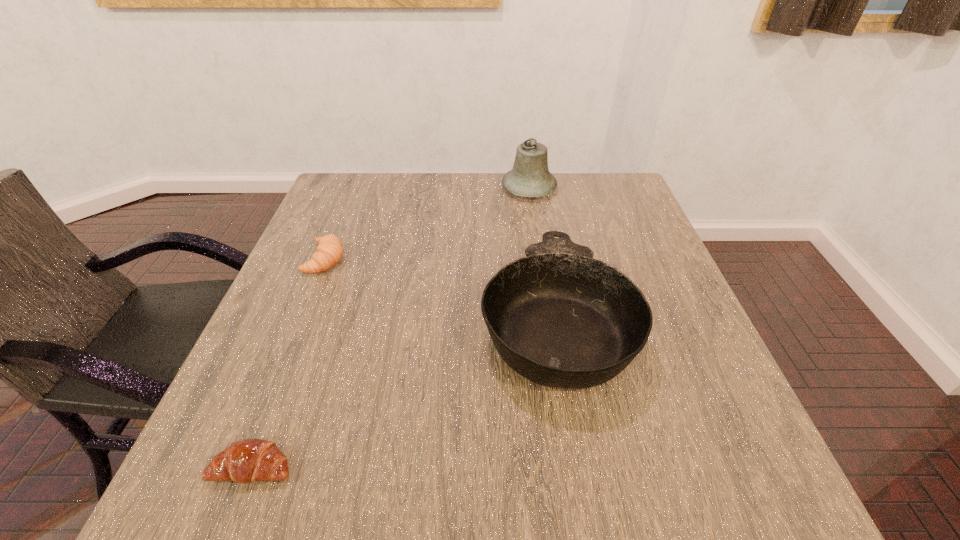
You are a GUI agent. You are given a task and a screenshot of the screen. Output one action in this format:
    pyautogui.click(x=<x>, y=<y>)
    Task: Click on the farthest object
    The width and height of the screenshot is (960, 540).
    Given the screenshot: What is the action you would take?
    pyautogui.click(x=530, y=177)

Where is `bell`? This screenshot has height=540, width=960. bell is located at coordinates (530, 177).

You are a GUI agent. You are given a task and a screenshot of the screen. Output one action in this format:
    pyautogui.click(x=<x>, y=<y>)
    Task: Click on the frying pan
    This screenshot has height=540, width=960.
    Given the screenshot: What is the action you would take?
    pyautogui.click(x=560, y=318)

Locate an element on the screen. Image resolution: width=960 pixels, height=540 pixels. the farther crescent roll is located at coordinates (329, 251).

Where is `the shortest object`? The image size is (960, 540). the shortest object is located at coordinates (245, 461).

Where is `the nearer crescent roll`? the nearer crescent roll is located at coordinates (245, 461).

I want to click on free space located 0.280m on the front of the bell, so click(541, 268).

Where is `free spot located with the handle extending from the side of the third shortest object`? The height and width of the screenshot is (540, 960). free spot located with the handle extending from the side of the third shortest object is located at coordinates (541, 238).

The image size is (960, 540). Identify the location of free spot located 0.270m with the handle extending from the side of the third shortest object. (534, 197).

Identify the location of free spot located with the handle extending from the side of the third shortest object. Image resolution: width=960 pixels, height=540 pixels. (531, 176).